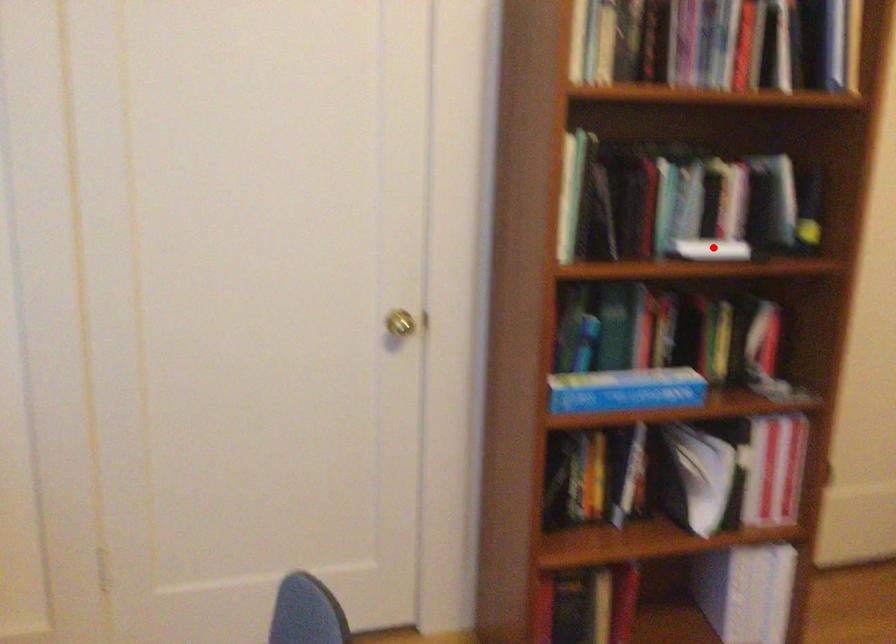
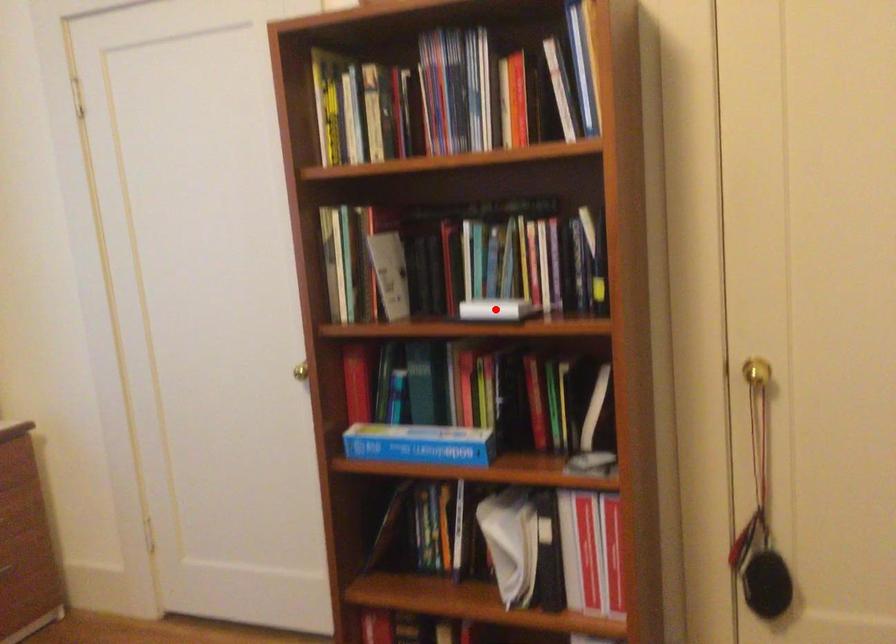
I am providing you with two images of the same scene from different viewpoints. A red point is marked on the first image and another point is marked on the second image. Does the point marked in image1 correspond to the same location as the one in image2?

Yes